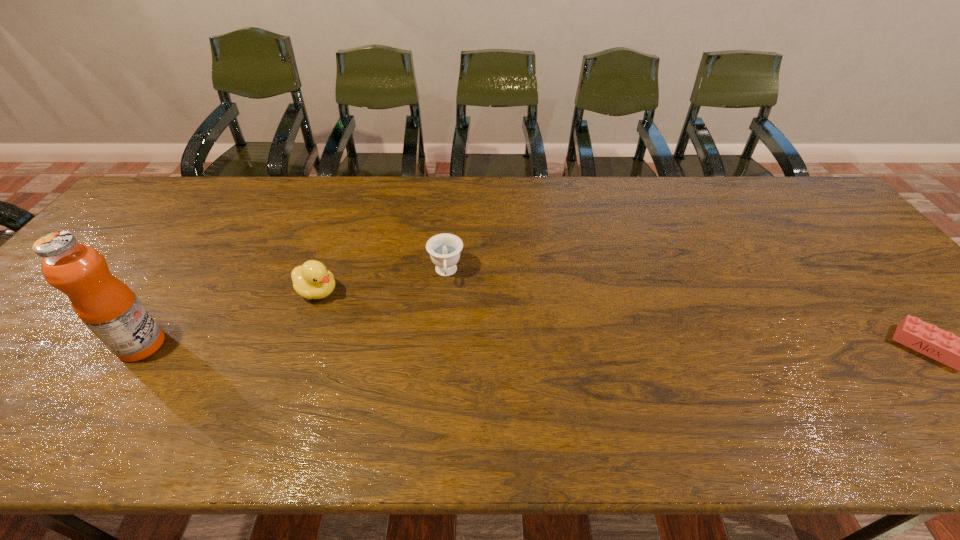
Where is `vacant space on the desktop that is between the leftmost object and the shortest object and is positioned on the beak of the duckling`? This screenshot has height=540, width=960. vacant space on the desktop that is between the leftmost object and the shortest object and is positioned on the beak of the duckling is located at coordinates (423, 346).

This screenshot has height=540, width=960. In order to click on free space on the desktop that is between the fruit juice and the shortest object and is positioned on the side of the teacup with the handle in this screenshot , I will do (x=447, y=346).